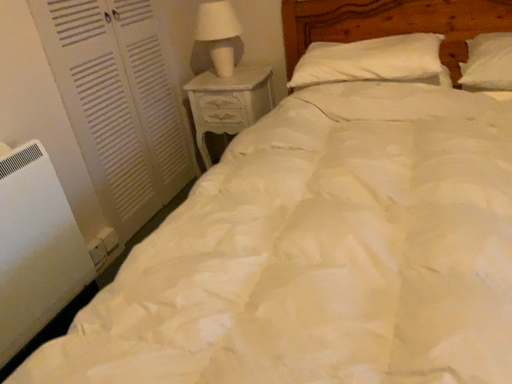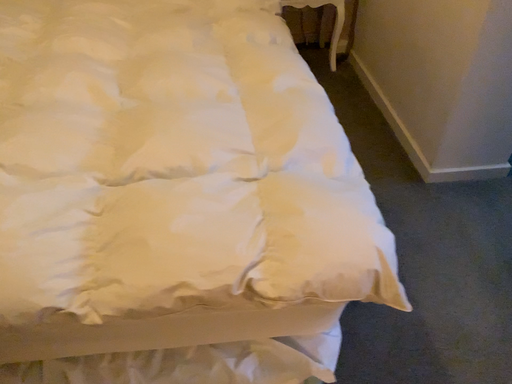
Question: Which way did the camera rotate in the video?

Choices:
 (A) rotated downward
 (B) rotated upward

Answer: (A)